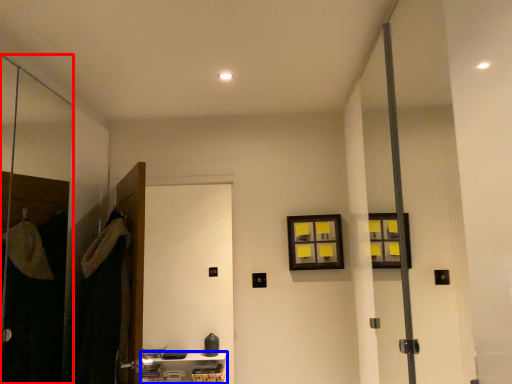
Question: Which point is closer to the camera, screen door (highlighted by a red box) or furniture (highlighted by a blue box)?

Choices:
 (A) screen door
 (B) furniture

Answer: (A)